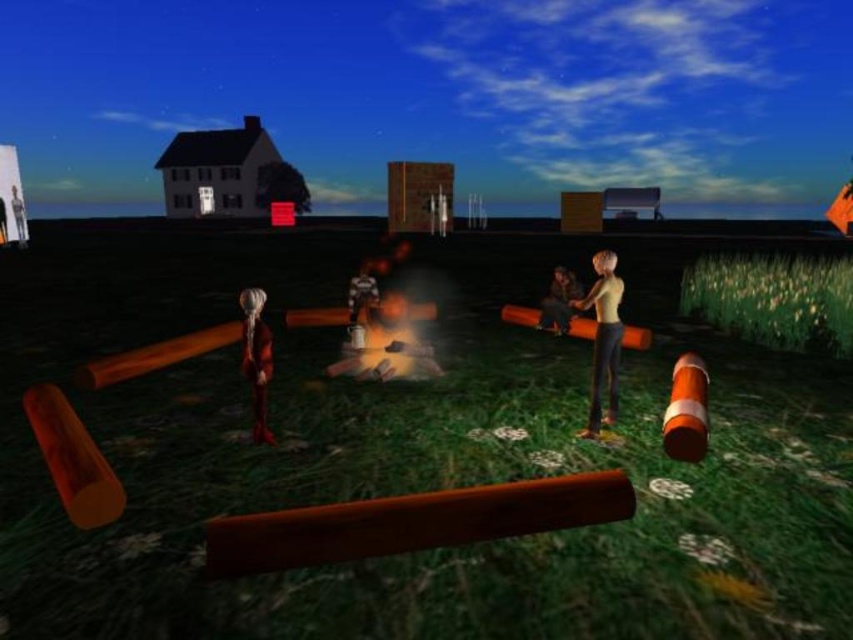
Question: Is leather jacket at center behind shiny metallic figure at center?

Choices:
 (A) yes
 (B) no

Answer: (A)

Question: Is leather jacket at center smaller than metallic silver figure at upper left?

Choices:
 (A) no
 (B) yes

Answer: (B)

Question: Which point is farther from the camera taking this photo?

Choices:
 (A) (364, 312)
 (B) (593, 298)

Answer: (A)

Question: Does leather jacket at center have a larger size compared to metallic silver figure at upper left?

Choices:
 (A) no
 (B) yes

Answer: (A)

Question: Which of these objects is positioned closest to the metallic silver figure at upper left?

Choices:
 (A) smooth beige shirt at center right
 (B) shiny red dress at center
 (C) shiny metallic figure at center
 (D) leather jacket at center

Answer: (B)

Question: Among these objects, which one is nearest to the camera?

Choices:
 (A) shiny metallic figure at center
 (B) metallic silver figure at upper left
 (C) smooth beige shirt at center right
 (D) leather jacket at center

Answer: (C)